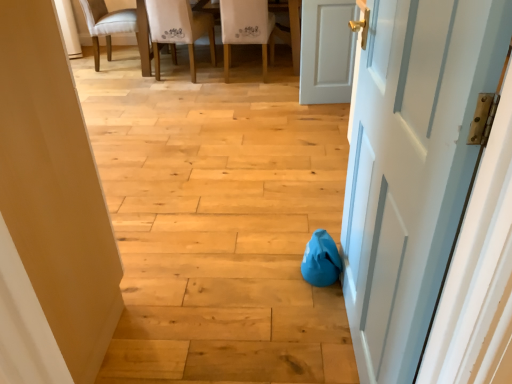
Identify the location of unoccupied area behind white painted wood door at right, which is the first door in front-to-back order. This screenshot has height=384, width=512. (288, 260).